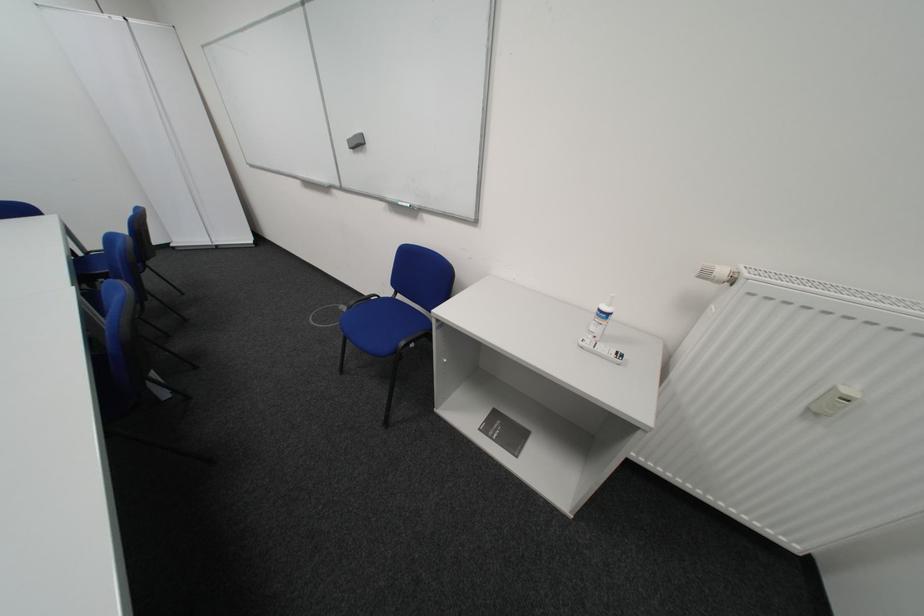
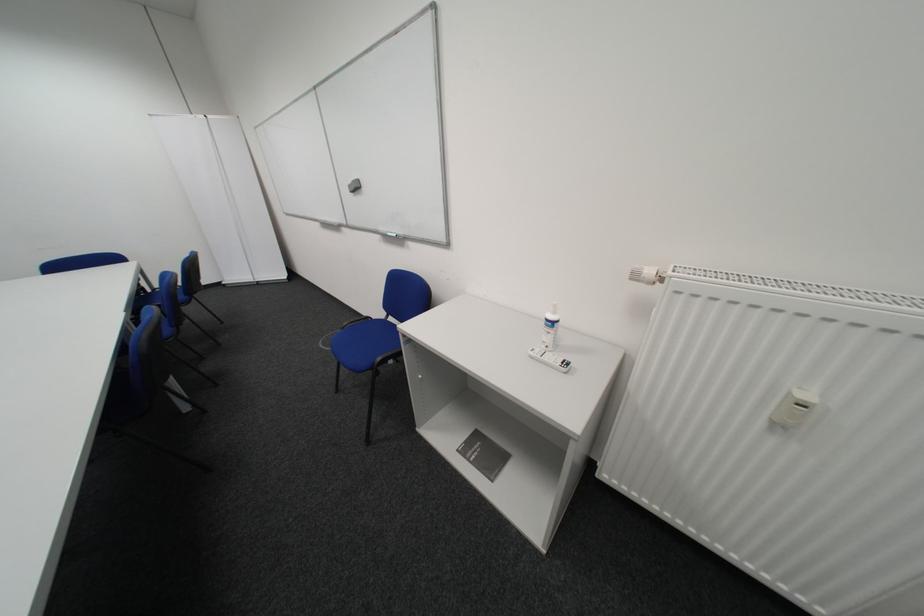
Question: In a continuous first-person perspective shot, in which direction is the camera moving?

Choices:
 (A) Left
 (B) Right
 (C) Forward
 (D) Backward

Answer: (B)